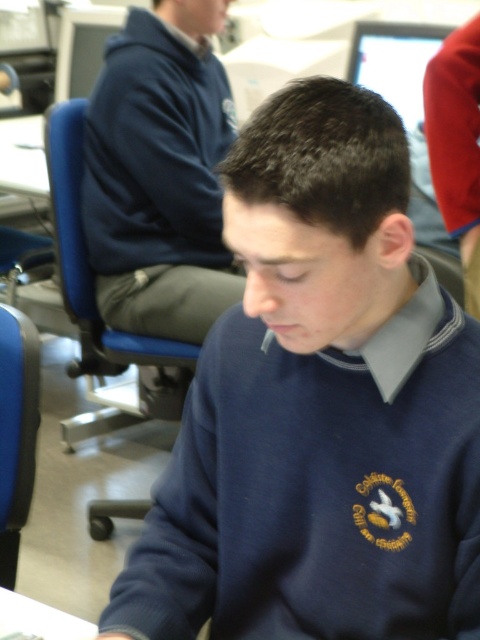
Question: Does navy blue sweater at center have a greater width compared to dark blue hoodie at upper left?

Choices:
 (A) yes
 (B) no

Answer: (A)

Question: Which of the following is the farthest from the observer?

Choices:
 (A) (383, 564)
 (B) (188, 208)

Answer: (B)

Question: Can you confirm if navy blue sweater at center is positioned to the right of dark blue hoodie at upper left?

Choices:
 (A) no
 (B) yes

Answer: (B)

Question: Which of the following is the closest to the observer?

Choices:
 (A) navy blue sweater at center
 (B) dark blue hoodie at upper left

Answer: (A)

Question: Is navy blue sweater at center in front of dark blue hoodie at upper left?

Choices:
 (A) yes
 (B) no

Answer: (A)